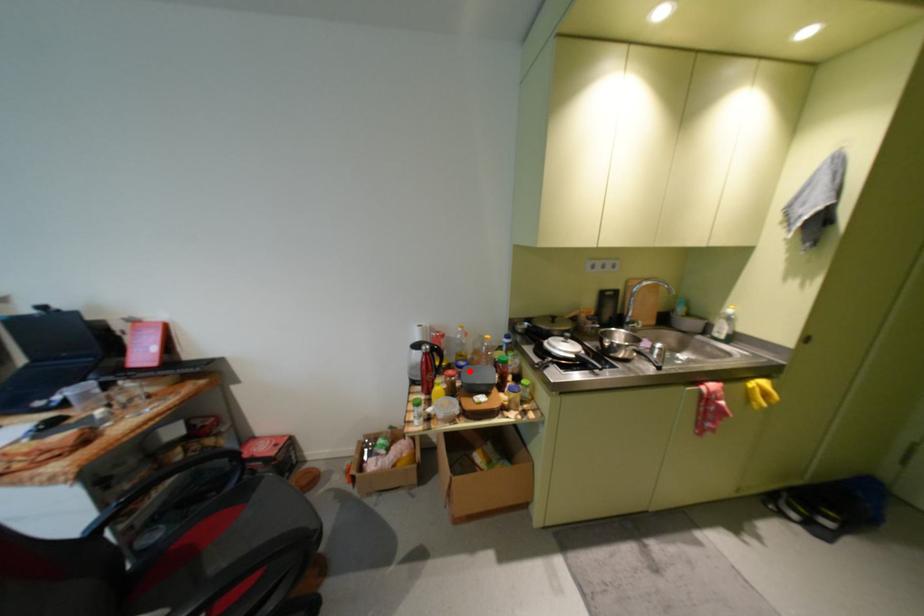
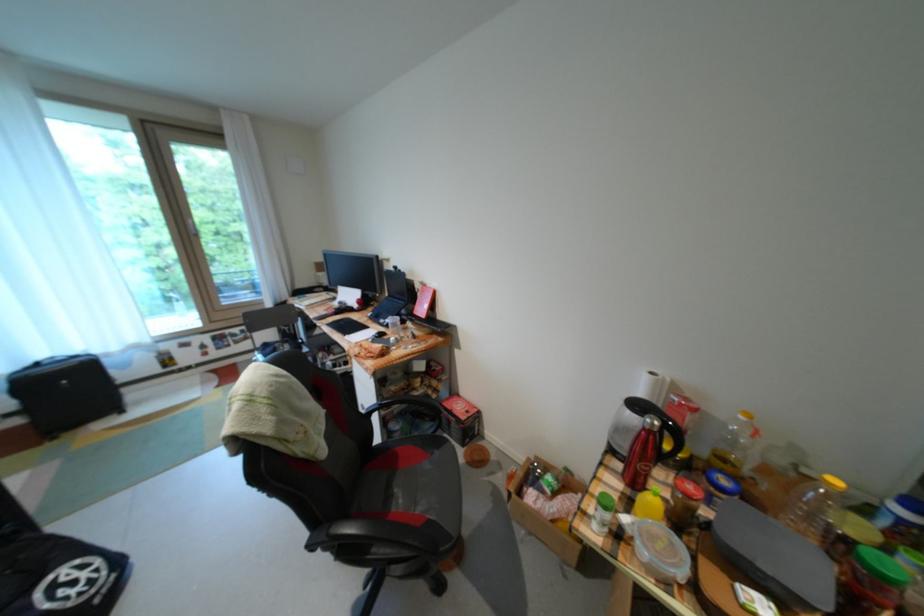
Find the pixel in the second image that matches the highlighted location in the first image.

(723, 490)